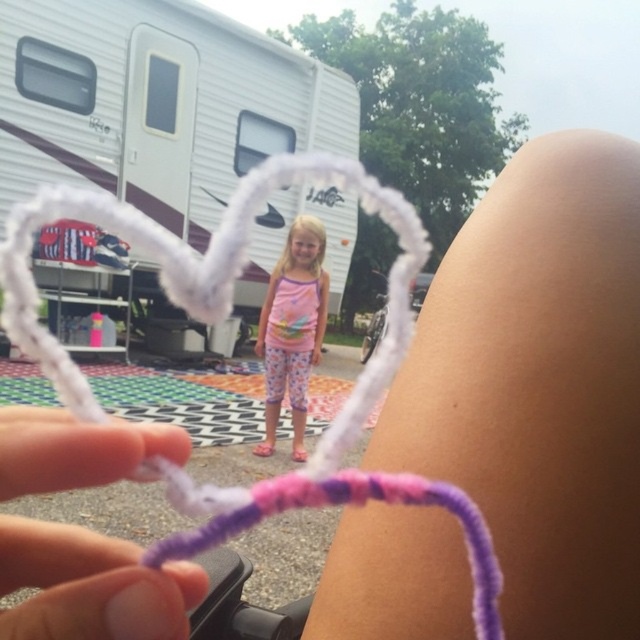
Measure the distance between point (58, 410) and camera.

The distance of point (58, 410) from camera is 7.15 inches.

Is point (3, 456) closer to camera compared to point (384, 276)?

Yes, it is.

This screenshot has width=640, height=640. Identify the location of purple yarn at lower left. (90, 586).

Describe the element at coordinates (225, 317) in the screenshot. I see `white/yarn heart at center` at that location.

Does white/yarn heart at center appear over pink fabric pants at center?

Yes, white/yarn heart at center is above pink fabric pants at center.

Is point (394, 205) farther from camera compared to point (289, 333)?

No.

This screenshot has height=640, width=640. In order to click on white/yarn heart at center in this screenshot , I will do `click(225, 317)`.

Is white/yarn heart at center further to camera compared to white plastic recreational vehicle at center?

No, it is not.

Between white/yarn heart at center and white plastic recreational vehicle at center, which one appears on the right side from the viewer's perspective?

white plastic recreational vehicle at center is more to the right.

Is point (353, 417) closer to camera compared to point (378, 316)?

Yes, it is.

What are the coordinates of `white/yarn heart at center` in the screenshot? It's located at (225, 317).